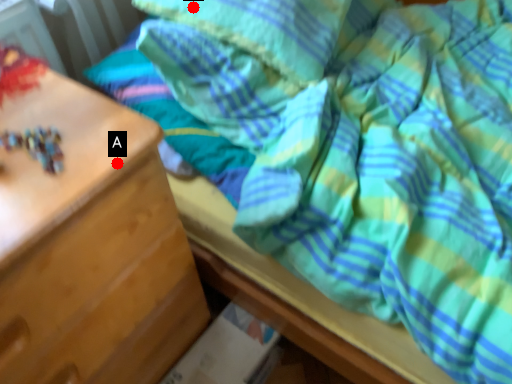
Question: Two points are circled on the image, labeled by A and B beside each circle. Which point appears farthest from the camera in this image?

Choices:
 (A) A is further
 (B) B is further

Answer: (B)